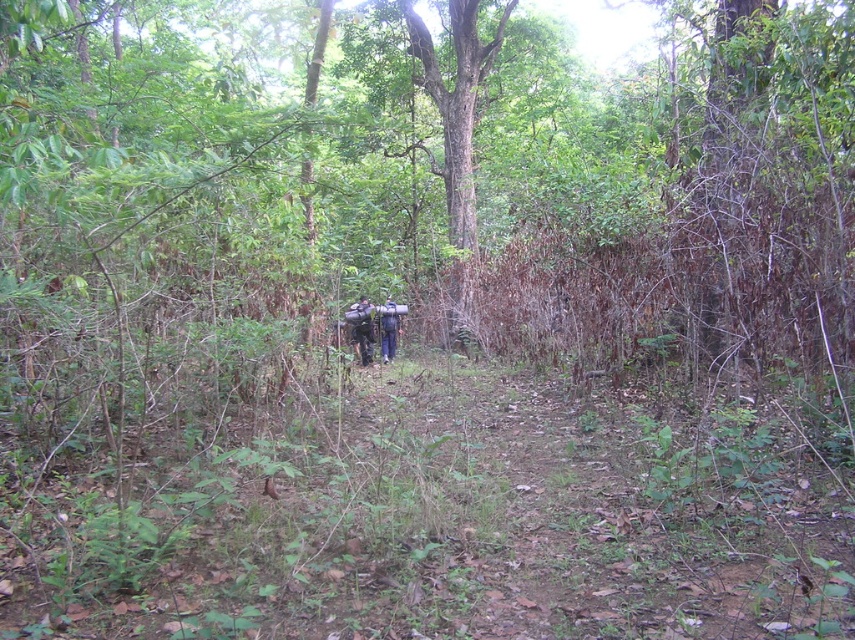
You are a hiker who wants to know the position of your backpacks. Which backpack is on the left side when looking at the dark green fabric backpack at center and the dark blue fabric backpack at center?

The dark green fabric backpack at center is positioned on the left side of the dark blue fabric backpack at center.

You are a hiker planning to carry both the dark green fabric backpack at center and the dark blue fabric backpack at center on a narrow trail. Which backpack will require more space between you and the trees on either side?

The dark green fabric backpack at center requires more space because its width surpasses that of the dark blue fabric backpack at center.

You are a hiker who wants to reach the dark green fabric backpack at center located on the forest path. If your walking speed is 1.5 meters per second, how many seconds will it take you to reach the backpack?

The distance between you and the dark green fabric backpack at center is 11.72 meters. At a speed of 1.5 meters per second, it would take approximately 7.8 seconds to reach it.